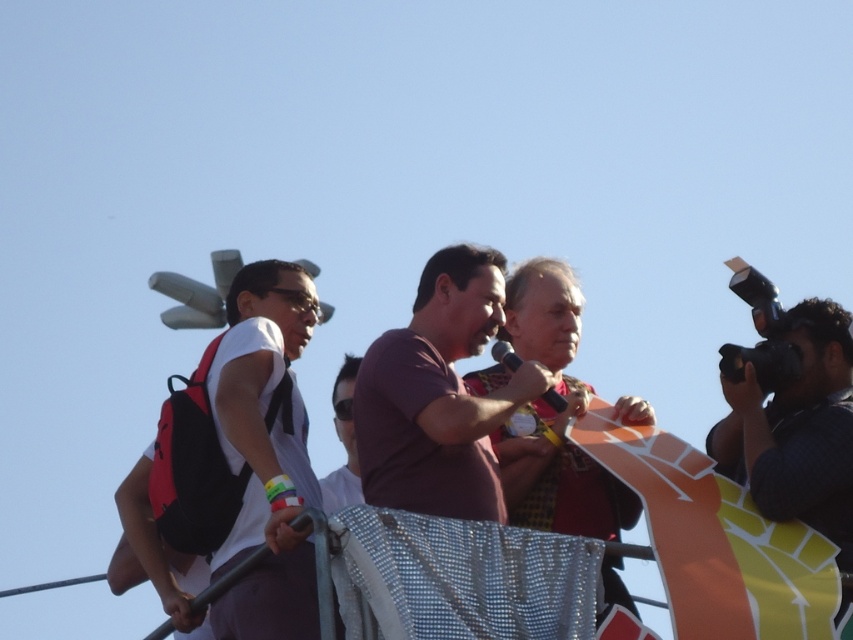
You are a photographer at the event and want to capture a photo of the purple matte shirt at center without the white matte shirt at left blocking it. How can you adjust your position to achieve this?

Move to the right side so that the white matte shirt at left is no longer in front of the purple matte shirt at center.

You are a photographer trying to capture a photo of the white matte shirt at left and the black textured camera at right. Since you want both subjects in focus, which one should you aim the camera at first?

You should aim the camera at the white matte shirt at left first because it is closer to the camera than the black textured camera at right, ensuring both are in focus when using depth of field techniques.